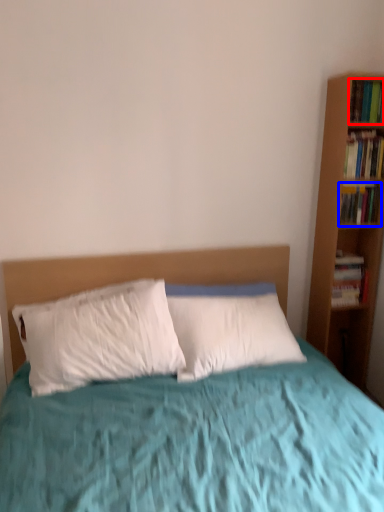
Question: Which object is closer to the camera taking this photo, book (highlighted by a red box) or book (highlighted by a blue box)?

Choices:
 (A) book
 (B) book

Answer: (A)